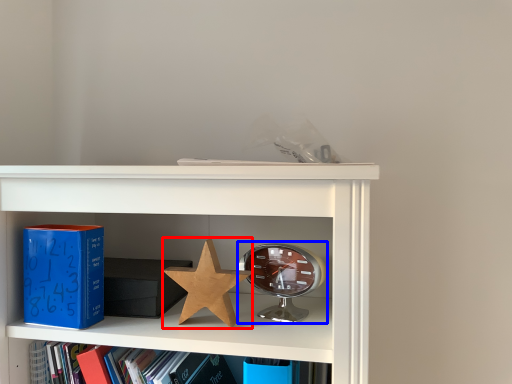
Question: Which object appears closest to the camera in this image, star (highlighted by a red box) or alarm clock (highlighted by a blue box)?

Choices:
 (A) star
 (B) alarm clock

Answer: (A)